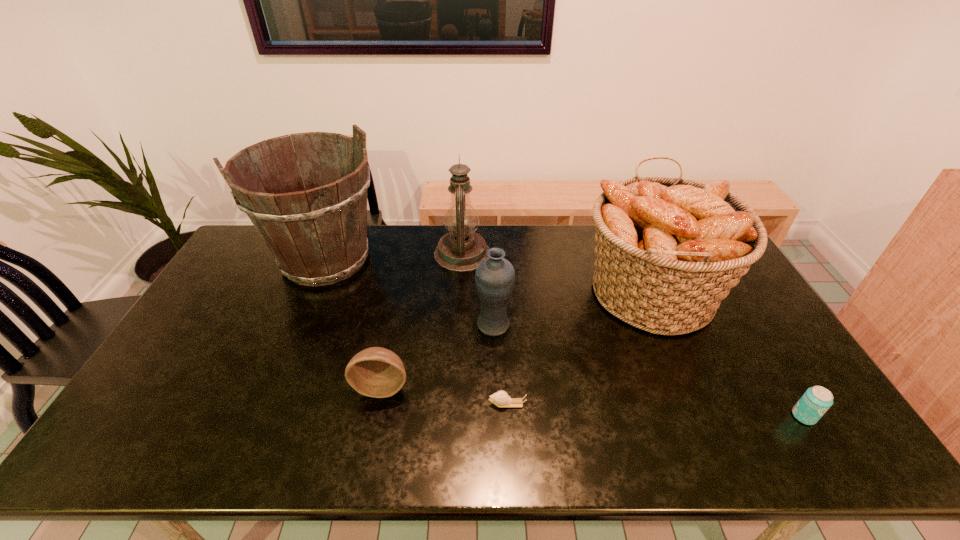
Locate an element on the screen. empty space between the basket and the fifth tallest object is located at coordinates (516, 339).

Locate an element on the screen. This screenshot has height=540, width=960. unoccupied position between the fourth tallest object and the bucket is located at coordinates (410, 292).

The width and height of the screenshot is (960, 540). I want to click on free point between the fourth shortest object and the leftmost object, so click(x=410, y=292).

Identify the location of free space that is in between the beer can and the vase. (649, 370).

The width and height of the screenshot is (960, 540). I want to click on free space that is in between the bowl and the second shortest object, so click(593, 401).

I want to click on free space that is in between the leftmost object and the oil lamp, so click(x=394, y=256).

Locate an element on the screen. This screenshot has width=960, height=540. the fourth closest object relative to the leftmost object is located at coordinates (501, 399).

Identify which object is the third closest to the beer can. Please provide its 2D coordinates. Your answer should be formatted as a tuple, i.e. [(x, y)], where the tuple contains the x and y coordinates of a point satisfying the conditions above.

[(495, 276)]

Identify the location of vacant space that satisfies the following two spatial constraints: 1. on the shell of the shortest object; 2. on the left side of the beer can. Image resolution: width=960 pixels, height=540 pixels. (508, 416).

Where is `blank area in the image that satisfies the following two spatial constraints: 1. on the front side of the bowl; 2. on the right side of the leftmost object`? This screenshot has height=540, width=960. blank area in the image that satisfies the following two spatial constraints: 1. on the front side of the bowl; 2. on the right side of the leftmost object is located at coordinates (273, 386).